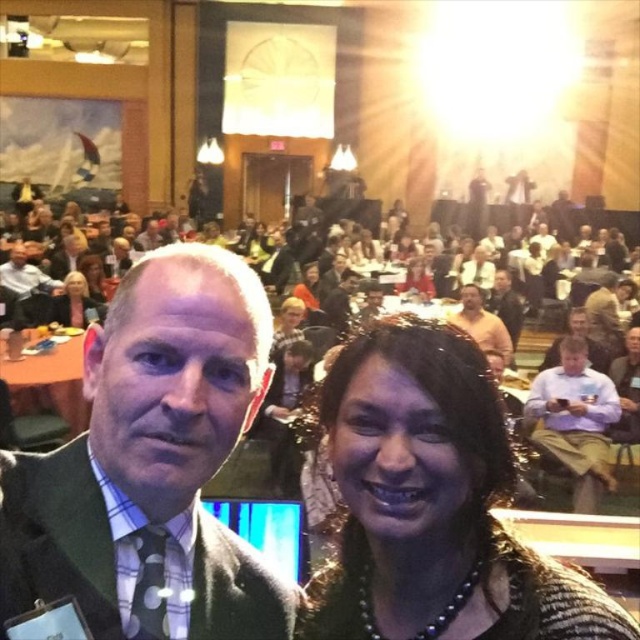
Can you confirm if orange sweater at center is bigger than matte black jacket at center?

Indeed, orange sweater at center has a larger size compared to matte black jacket at center.

What do you see at coordinates (481, 324) in the screenshot?
I see `orange sweater at center` at bounding box center [481, 324].

At what (x,y) coordinates should I click in order to perform the action: click on orange sweater at center. Please return your answer as a coordinate pair (x, y). This screenshot has width=640, height=640. Looking at the image, I should click on (481, 324).

Between light blue shirt at center and light brown leather jacket at lower right, which one has less height?

light brown leather jacket at lower right

Does light blue shirt at center appear on the left side of light brown leather jacket at lower right?

Yes, light blue shirt at center is to the left of light brown leather jacket at lower right.

Who is more forward, (589, 387) or (621, 374)?

Positioned in front is point (589, 387).

The image size is (640, 640). What are the coordinates of `light blue shirt at center` in the screenshot? It's located at (573, 420).

Where is `light blue shirt at center`? light blue shirt at center is located at coordinates (573, 420).

I want to click on light blue shirt at center, so click(x=573, y=420).